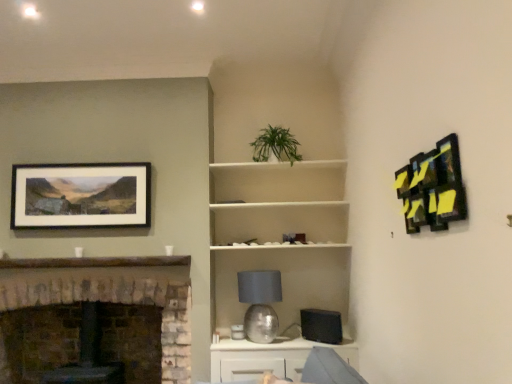
Question: From a real-world perspective, is matte black picture frame at upper left, which is counted as the first picture frame, starting from the back, physically below white matte shelf at center?

Choices:
 (A) yes
 (B) no

Answer: (B)

Question: Is matte black picture frame at upper left, the second picture frame from the right, further to camera compared to white matte shelf at center?

Choices:
 (A) yes
 (B) no

Answer: (A)

Question: Does matte black picture frame at upper left, the second picture frame from the front, have a lesser height compared to white matte shelf at center?

Choices:
 (A) no
 (B) yes

Answer: (B)

Question: Would you consider matte black picture frame at upper left, the second picture frame from the front, to be distant from white matte shelf at center?

Choices:
 (A) yes
 (B) no

Answer: (A)

Question: Does matte black picture frame at upper left, the second picture frame from the right, have a greater width compared to white matte shelf at center?

Choices:
 (A) no
 (B) yes

Answer: (A)

Question: Would you say green leafy plant at upper center is inside or outside silver metallic table lamp at center?

Choices:
 (A) outside
 (B) inside

Answer: (A)

Question: Considering the positions of point (273, 147) and point (244, 299), is point (273, 147) closer or farther from the camera than point (244, 299)?

Choices:
 (A) closer
 (B) farther

Answer: (B)

Question: Looking at the image, does green leafy plant at upper center seem bigger or smaller compared to silver metallic table lamp at center?

Choices:
 (A) big
 (B) small

Answer: (B)

Question: From their relative heights in the image, would you say green leafy plant at upper center is taller or shorter than silver metallic table lamp at center?

Choices:
 (A) short
 (B) tall

Answer: (A)

Question: Considering the positions of white matte shelf at center and white glossy cabinet at lower center in the image, is white matte shelf at center taller or shorter than white glossy cabinet at lower center?

Choices:
 (A) short
 (B) tall

Answer: (B)

Question: From a real-world perspective, relative to white glossy cabinet at lower center, is white matte shelf at center vertically above or below?

Choices:
 (A) above
 (B) below

Answer: (A)

Question: From the image's perspective, is white matte shelf at center located above or below white glossy cabinet at lower center?

Choices:
 (A) below
 (B) above

Answer: (B)

Question: Is white matte shelf at center inside or outside of white glossy cabinet at lower center?

Choices:
 (A) inside
 (B) outside

Answer: (B)

Question: Looking at their shapes, would you say matte black picture frame at upper left, the second picture frame from the right, is wider or thinner than stone fireplace at left?

Choices:
 (A) thin
 (B) wide

Answer: (A)

Question: Considering the positions of matte black picture frame at upper left, acting as the first picture frame starting from the left, and stone fireplace at left in the image, is matte black picture frame at upper left, acting as the first picture frame starting from the left, taller or shorter than stone fireplace at left?

Choices:
 (A) short
 (B) tall

Answer: (A)